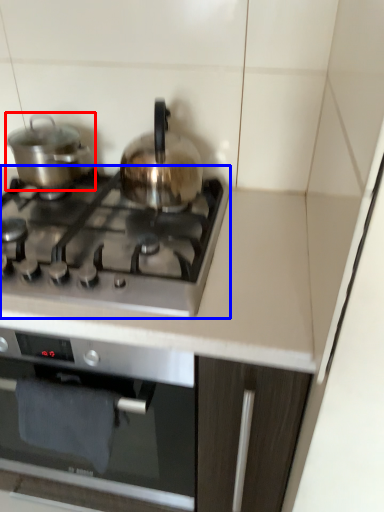
Question: Which of the following is the farthest to the observer, kitchen appliance (highlighted by a red box) or gas stove (highlighted by a blue box)?

Choices:
 (A) kitchen appliance
 (B) gas stove

Answer: (A)